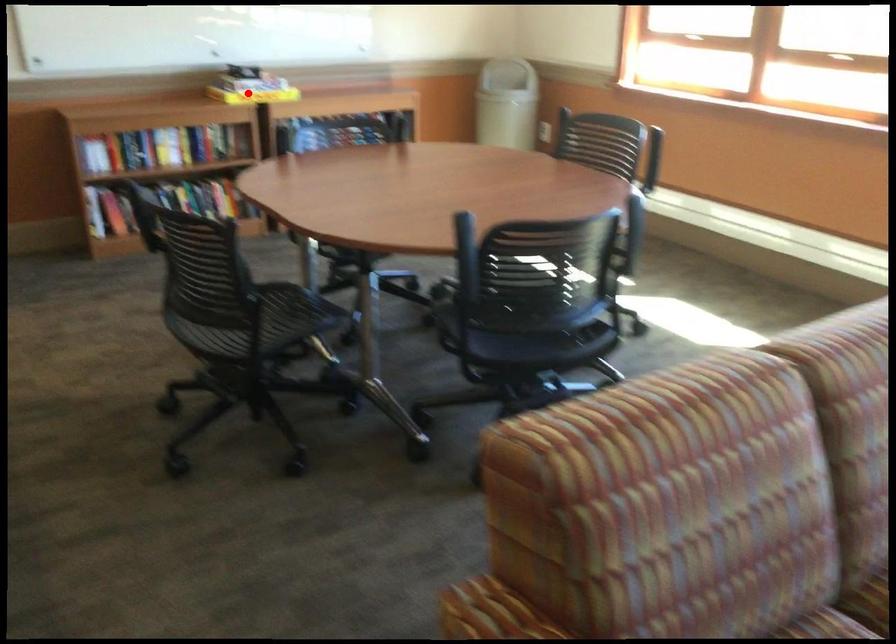
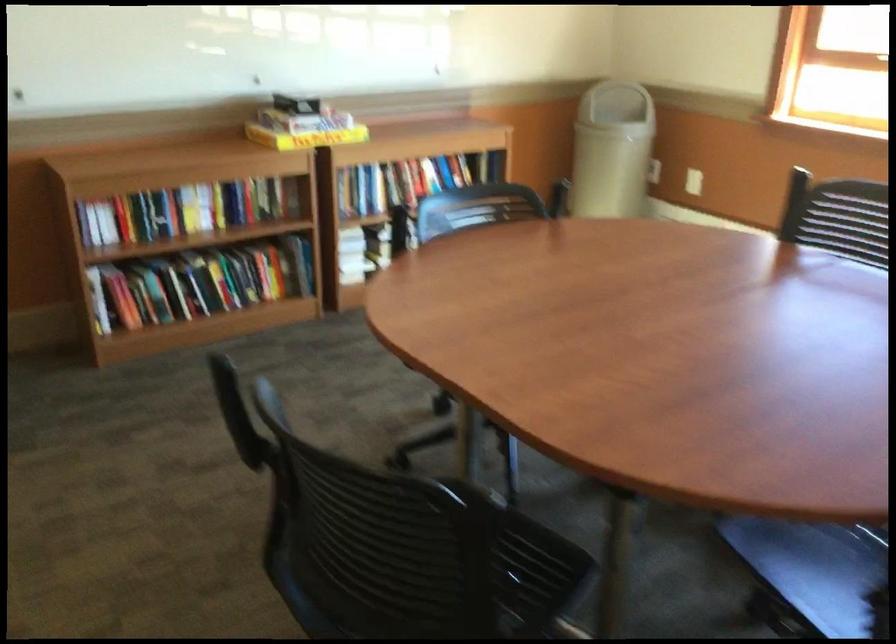
Find the pixel in the second image that matches the highlighted location in the first image.

(306, 138)